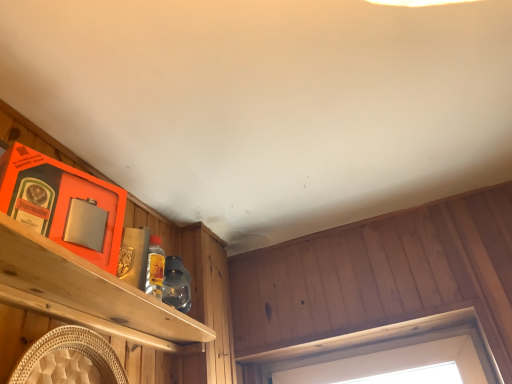
Describe the element at coordinates (374, 337) in the screenshot. The image size is (512, 384). I see `wooden frame at upper center` at that location.

This screenshot has height=384, width=512. Identify the location of wooden frame at upper center. (374, 337).

Describe the element at coordinates (87, 288) in the screenshot. I see `brushed metal shelf at left` at that location.

What is the approximate height of brushed metal shelf at left?

1.56 inches.

This screenshot has height=384, width=512. Find the location of `brushed metal shelf at left`. brushed metal shelf at left is located at coordinates (87, 288).

You are a GUI agent. You are given a task and a screenshot of the screen. Output one action in this format:
    pyautogui.click(x=<x>, y=<y>)
    Task: Click on the wooden frame at upper center
    This screenshot has height=384, width=512.
    Given the screenshot: What is the action you would take?
    pyautogui.click(x=374, y=337)

Looking at this image, would you say brushed metal shelf at left is to the left or to the right of wooden frame at upper center in the picture?

brushed metal shelf at left is to the left of wooden frame at upper center.

Considering the positions of objects brushed metal shelf at left and wooden frame at upper center in the image provided, who is behind, brushed metal shelf at left or wooden frame at upper center?

wooden frame at upper center.

Between point (117, 279) and point (483, 337), which one is positioned behind?

The point (483, 337) is farther.

From the image's perspective, is brushed metal shelf at left above or below wooden frame at upper center?

brushed metal shelf at left is situated higher than wooden frame at upper center in the image.

From a real-world perspective, is brushed metal shelf at left over wooden frame at upper center?

No.

From the picture: Between brushed metal shelf at left and wooden frame at upper center, which one has larger width?

wooden frame at upper center is wider.

Which of these two, brushed metal shelf at left or wooden frame at upper center, stands taller?

With more height is brushed metal shelf at left.

Between brushed metal shelf at left and wooden frame at upper center, which one has larger size?

brushed metal shelf at left.

Can wooden frame at upper center be found inside brushed metal shelf at left?

No, brushed metal shelf at left does not contain wooden frame at upper center.

Would you consider brushed metal shelf at left to be distant from wooden frame at upper center?

Actually, brushed metal shelf at left and wooden frame at upper center are a little close together.

Is brushed metal shelf at left facing towards wooden frame at upper center?

No, brushed metal shelf at left does not turn towards wooden frame at upper center.

This screenshot has width=512, height=384. Identify the location of window located behind the brushed metal shelf at left. (374, 337).

Is wooden frame at upper center to the right of brushed metal shelf at left from the viewer's perspective?

Correct, you'll find wooden frame at upper center to the right of brushed metal shelf at left.

Is wooden frame at upper center closer to camera compared to brushed metal shelf at left?

That is False.

Is point (487, 344) behind point (199, 327)?

Yes, point (487, 344) is behind point (199, 327).

From the image's perspective, between wooden frame at upper center and brushed metal shelf at left, who is located below?

From the image's view, wooden frame at upper center is below.

From a real-world perspective, who is located higher, wooden frame at upper center or brushed metal shelf at left?

In real-world perspective, wooden frame at upper center is above.

Can you confirm if wooden frame at upper center is thinner than brushed metal shelf at left?

No, wooden frame at upper center is not thinner than brushed metal shelf at left.

Is wooden frame at upper center taller or shorter than brushed metal shelf at left?

Clearly, wooden frame at upper center is shorter compared to brushed metal shelf at left.

Can you confirm if wooden frame at upper center is smaller than brushed metal shelf at left?

Correct, wooden frame at upper center occupies less space than brushed metal shelf at left.

Is wooden frame at upper center positioned beyond the bounds of brushed metal shelf at left?

Absolutely, wooden frame at upper center is external to brushed metal shelf at left.

Is wooden frame at upper center far from brushed metal shelf at left?

No, wooden frame at upper center is in close proximity to brushed metal shelf at left.

Does wooden frame at upper center turn towards brushed metal shelf at left?

Yes, wooden frame at upper center is aimed at brushed metal shelf at left.

I want to click on shelf below the wooden frame at upper center (from a real-world perspective), so click(87, 288).

Where is `shelf that is in front of the wooden frame at upper center`? shelf that is in front of the wooden frame at upper center is located at coordinates (87, 288).

At what (x,y) coordinates should I click in order to perform the action: click on shelf on the left of wooden frame at upper center. Please return your answer as a coordinate pair (x, y). The height and width of the screenshot is (384, 512). Looking at the image, I should click on (87, 288).